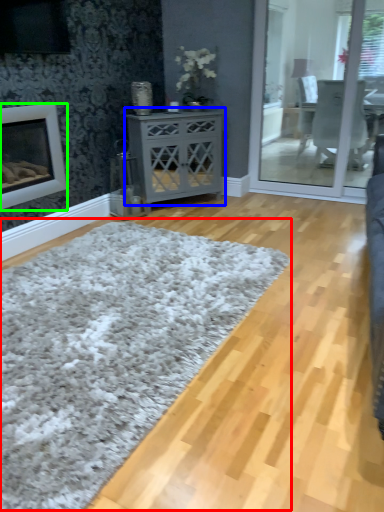
Question: Based on their relative distances, which object is farther from plain (highlighted by a red box)? Choose from nightstand (highlighted by a blue box) and fireplace (highlighted by a green box).

Choices:
 (A) nightstand
 (B) fireplace

Answer: (A)